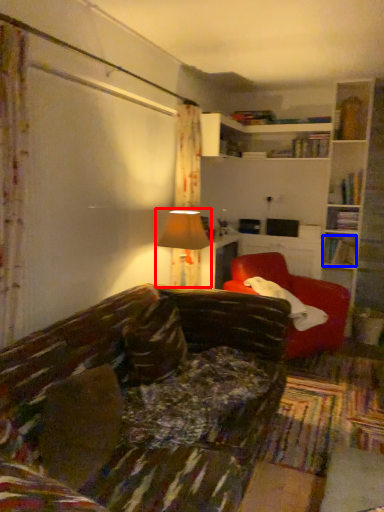
Question: Which point is further to the camera, table lamp (highlighted by a red box) or book (highlighted by a blue box)?

Choices:
 (A) table lamp
 (B) book

Answer: (B)